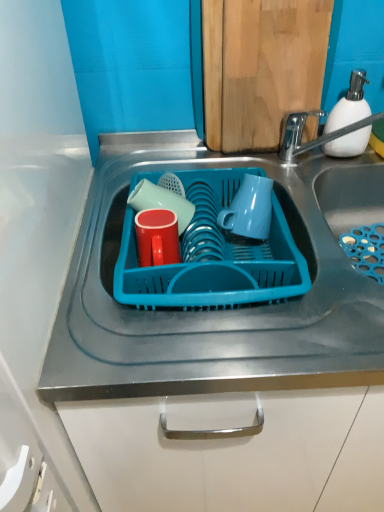
At what (x,y) coordinates should I click in order to perform the action: click on blue plastic basket at center. Please return your answer as a coordinate pair (x, y). Image resolution: width=384 pixels, height=512 pixels. Looking at the image, I should click on tap(213, 255).

Image resolution: width=384 pixels, height=512 pixels. What do you see at coordinates (161, 202) in the screenshot?
I see `matte red cup at center, the first tableware in the back-to-front sequence` at bounding box center [161, 202].

The height and width of the screenshot is (512, 384). I want to click on blue plastic tray at center, so click(x=212, y=309).

Describe the element at coordinates (157, 237) in the screenshot. I see `matte red cup at center, the second tableware positioned from the back` at that location.

Locate an element on the screen. The height and width of the screenshot is (512, 384). blue plastic basket at center is located at coordinates (213, 255).

Is matte red cup at center, the first tableware in the front-to-back sequence, far from blue plastic tray at center?

That's not correct — matte red cup at center, the first tableware in the front-to-back sequence, is a little close to blue plastic tray at center.

How different are the orientations of matte red cup at center, the second tableware positioned from the back, and blue plastic tray at center in degrees?

The facing directions of matte red cup at center, the second tableware positioned from the back, and blue plastic tray at center are 0.000523 degrees apart.

Visually, is matte red cup at center, the second tableware positioned from the back, positioned to the left or to the right of blue plastic tray at center?

From the image, it's evident that matte red cup at center, the second tableware positioned from the back, is to the left of blue plastic tray at center.

What are the coordinates of `sink below the matte red cup at center, the second tableware positioned from the back (from the image's perspective)` in the screenshot? It's located at (212, 309).

Is blue plastic basket at center inside the boundaries of white matte soap dispenser at upper right, or outside?

blue plastic basket at center is outside white matte soap dispenser at upper right.

Is blue plastic basket at center shorter than white matte soap dispenser at upper right?

Correct, blue plastic basket at center is not as tall as white matte soap dispenser at upper right.

Does blue plastic basket at center come in front of white matte soap dispenser at upper right?

Yes, the depth of blue plastic basket at center is less than that of white matte soap dispenser at upper right.

Consider the image. Between matte blue mug at center and blue plastic basket at center, which one is positioned in front?

blue plastic basket at center.

Considering the relative sizes of matte blue mug at center and blue plastic basket at center in the image provided, is matte blue mug at center shorter than blue plastic basket at center?

Correct, matte blue mug at center is not as tall as blue plastic basket at center.

Does matte blue mug at center touch blue plastic basket at center?

No, matte blue mug at center is not in contact with blue plastic basket at center.

Is matte blue mug at center to the left or to the right of blue plastic basket at center in the image?

In the image, matte blue mug at center appears on the right side of blue plastic basket at center.

Considering the sizes of matte red cup at center, the second tableware positioned from the back, and matte blue mug at center in the image, is matte red cup at center, the second tableware positioned from the back, wider or thinner than matte blue mug at center?

In the image, matte red cup at center, the second tableware positioned from the back, appears to be more narrow than matte blue mug at center.

From a real-world perspective, which object stands above the other?

In real-world perspective, matte blue mug at center is above.

Where is `mug above the matte red cup at center, the first tableware in the front-to-back sequence (from the image's perspective)`? The width and height of the screenshot is (384, 512). mug above the matte red cup at center, the first tableware in the front-to-back sequence (from the image's perspective) is located at coordinates (249, 209).

The width and height of the screenshot is (384, 512). There is a blue plastic tray at center. What are the coordinates of `the 2nd tableware above it (from a real-world perspective)` in the screenshot? It's located at (161, 202).

Is blue plastic tray at center looking in the opposite direction of matte red cup at center, which is counted as the 2th tableware, starting from the front?

No, matte red cup at center, which is counted as the 2th tableware, starting from the front, is not at the back of blue plastic tray at center.

From a real-world perspective, is blue plastic tray at center physically below matte red cup at center, the first tableware in the back-to-front sequence?

Indeed, from a real-world perspective, blue plastic tray at center is positioned beneath matte red cup at center, the first tableware in the back-to-front sequence.

Could you tell me if blue plastic basket at center is facing matte blue mug at center?

No, blue plastic basket at center is not facing towards matte blue mug at center.

Considering the positions of objects blue plastic basket at center and matte blue mug at center in the image provided, who is more to the left, blue plastic basket at center or matte blue mug at center?

blue plastic basket at center is more to the left.

Relative to matte blue mug at center, is blue plastic basket at center in front or behind?

In the image, blue plastic basket at center appears in front of matte blue mug at center.

Does blue plastic basket at center have a greater width compared to matte blue mug at center?

Indeed, blue plastic basket at center has a greater width compared to matte blue mug at center.

Considering the points (276, 327) and (217, 243), which point is in front, point (276, 327) or point (217, 243)?

The point (276, 327) is more forward.

Consider the image. Is the surface of blue plastic tray at center in direct contact with blue plastic basket at center?

Absolutely, blue plastic tray at center is next to and touching blue plastic basket at center.

From the picture: Is blue plastic tray at center looking in the opposite direction of blue plastic basket at center?

That's not correct — blue plastic tray at center is not looking away from blue plastic basket at center.

Considering the relative positions of blue plastic tray at center and blue plastic basket at center in the image provided, is blue plastic tray at center to the right of blue plastic basket at center from the viewer's perspective?

Correct, you'll find blue plastic tray at center to the right of blue plastic basket at center.

At what (x,y) coordinates should I click in order to perform the action: click on sink below the matte red cup at center, the second tableware positioned from the back (from the image's perspective). Please return your answer as a coordinate pair (x, y). Looking at the image, I should click on (212, 309).

Where is `basket to the left of white matte soap dispenser at upper right`? basket to the left of white matte soap dispenser at upper right is located at coordinates (213, 255).

When comparing their distances from white matte soap dispenser at upper right, does blue plastic basket at center or matte red cup at center, the second tableware positioned from the back, seem further?

matte red cup at center, the second tableware positioned from the back, lies further to white matte soap dispenser at upper right than the other object.

Based on their spatial positions, is matte blue mug at center or matte red cup at center, which is counted as the 2th tableware, starting from the front, further from blue plastic basket at center?

matte blue mug at center lies further to blue plastic basket at center than the other object.

Estimate the real-world distances between objects in this image. Which object is closer to blue plastic tray at center, matte red cup at center, the first tableware in the front-to-back sequence, or matte blue mug at center?

The object closer to blue plastic tray at center is matte red cup at center, the first tableware in the front-to-back sequence.

Based on their spatial positions, is white matte soap dispenser at upper right or matte blue mug at center closer to matte red cup at center, the first tableware in the back-to-front sequence?

Among the two, matte blue mug at center is located nearer to matte red cup at center, the first tableware in the back-to-front sequence.

Considering their positions, is matte red cup at center, which is counted as the 2th tableware, starting from the front, positioned closer to matte blue mug at center than blue plastic tray at center?

matte red cup at center, which is counted as the 2th tableware, starting from the front.

Based on the photo, looking at the image, which one is located closer to white matte soap dispenser at upper right, blue plastic tray at center or matte blue mug at center?

The object closer to white matte soap dispenser at upper right is matte blue mug at center.

Looking at the image, which one is located further to blue plastic basket at center, white matte soap dispenser at upper right or matte blue mug at center?

Based on the image, white matte soap dispenser at upper right appears to be further to blue plastic basket at center.

From the image, which object appears to be nearer to matte blue mug at center, matte red cup at center, the second tableware positioned from the back, or matte red cup at center, which is counted as the 2th tableware, starting from the front?

matte red cup at center, which is counted as the 2th tableware, starting from the front, is positioned closer to the anchor matte blue mug at center.

Image resolution: width=384 pixels, height=512 pixels. I want to click on mug between matte red cup at center, the first tableware in the front-to-back sequence, and white matte soap dispenser at upper right, in the horizontal direction, so click(249, 209).

Where is `sink between blue plastic basket at center and white matte soap dispenser at upper right`? Image resolution: width=384 pixels, height=512 pixels. sink between blue plastic basket at center and white matte soap dispenser at upper right is located at coordinates (212, 309).

Locate an element on the screen. basket between matte red cup at center, the first tableware in the back-to-front sequence, and blue plastic tray at center is located at coordinates (213, 255).

Identify the location of sink between matte red cup at center, the first tableware in the front-to-back sequence, and white matte soap dispenser at upper right. (212, 309).